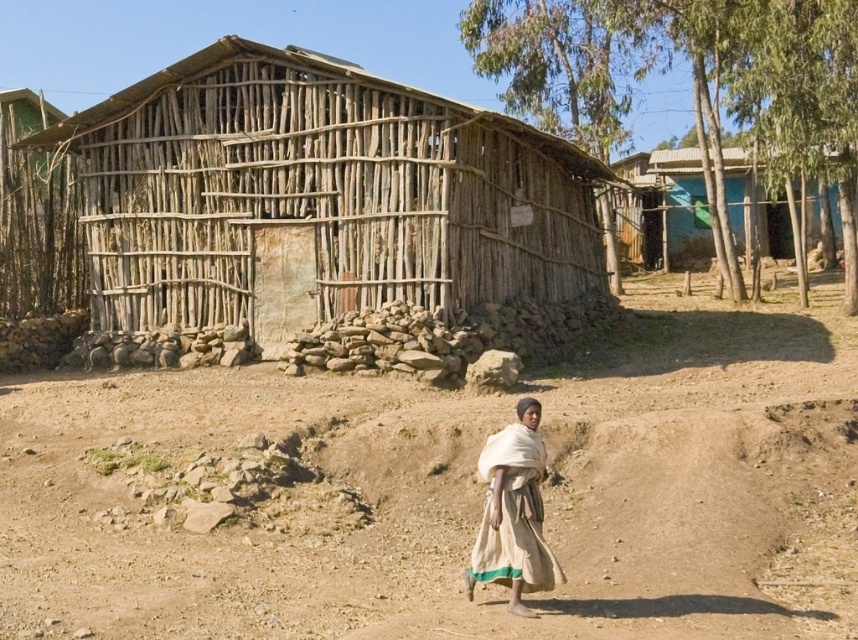
Question: Is brown sandy dirt field at lower center above natural wood hut at center?

Choices:
 (A) no
 (B) yes

Answer: (A)

Question: Does blue painted wood at upper right lie behind beige fabric shawl at lower right?

Choices:
 (A) yes
 (B) no

Answer: (A)

Question: Which object is farther from the camera taking this photo?

Choices:
 (A) blue painted wood at upper right
 (B) brown sandy dirt field at lower center

Answer: (A)

Question: Among these objects, which one is farthest from the camera?

Choices:
 (A) natural wood hut at center
 (B) blue painted wood at upper right
 (C) beige fabric shawl at lower right

Answer: (B)

Question: Which object appears farthest from the camera in this image?

Choices:
 (A) brown sandy dirt field at lower center
 (B) beige fabric shawl at lower right
 (C) blue painted wood at upper right

Answer: (C)

Question: Does brown sandy dirt field at lower center appear on the right side of blue painted wood at upper right?

Choices:
 (A) no
 (B) yes

Answer: (A)